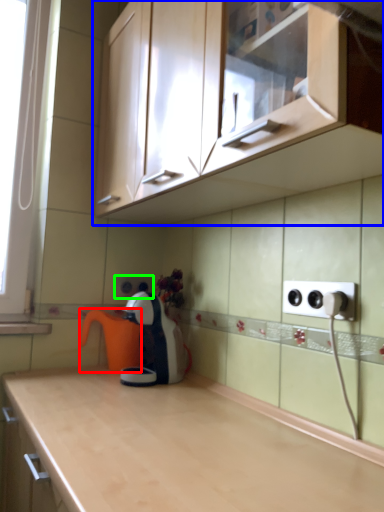
Question: Estimate the real-world distances between objects in this image. Which object is farther from coffeepot (highlighted by a red box), cabinetry (highlighted by a blue box) or electric outlet (highlighted by a green box)?

Choices:
 (A) cabinetry
 (B) electric outlet

Answer: (A)